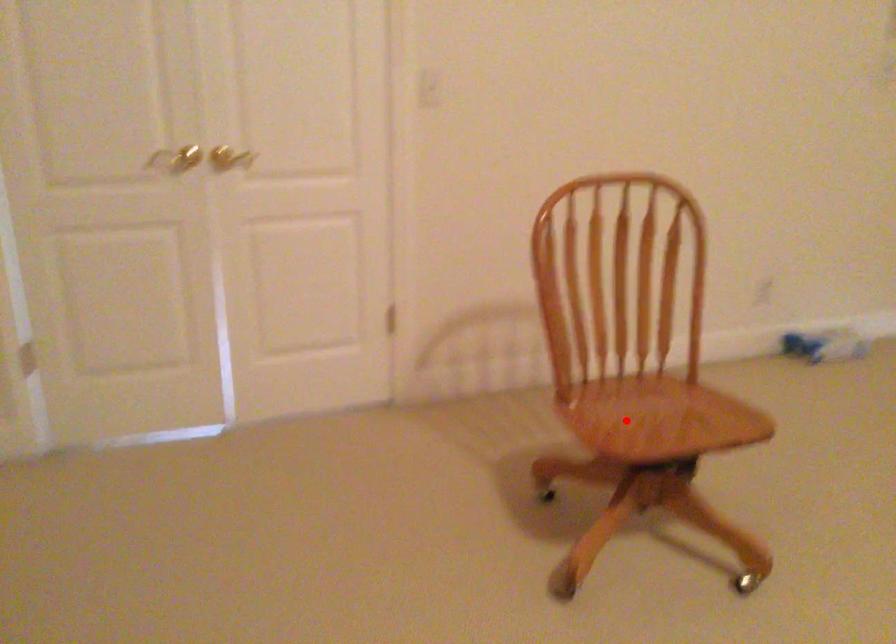
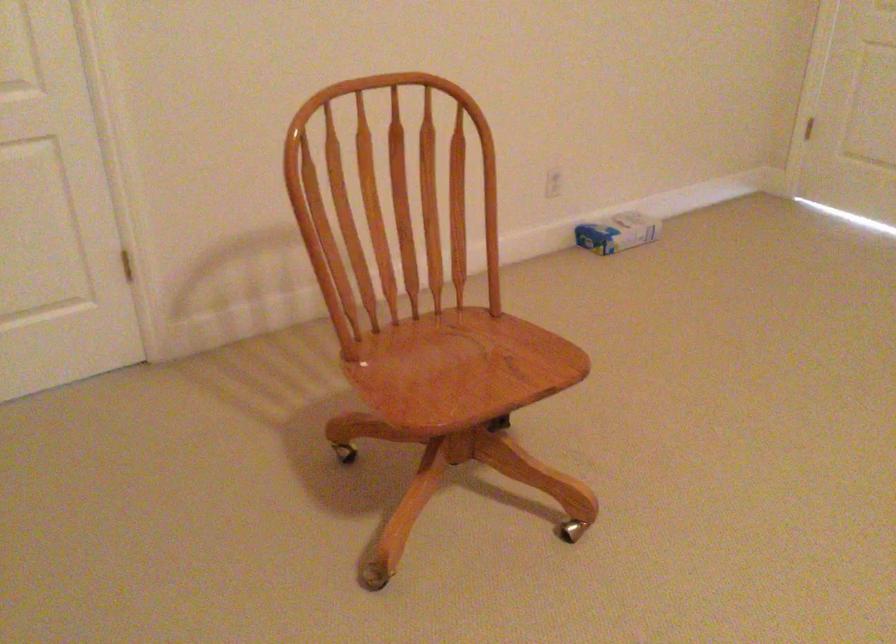
Question: I am providing you with two images of the same scene from different viewpoints. In image1, a red point is highlighted. Considering the same 3D point in image2, which of the following is correct?

Choices:
 (A) It is closer
 (B) It is farther

Answer: (A)